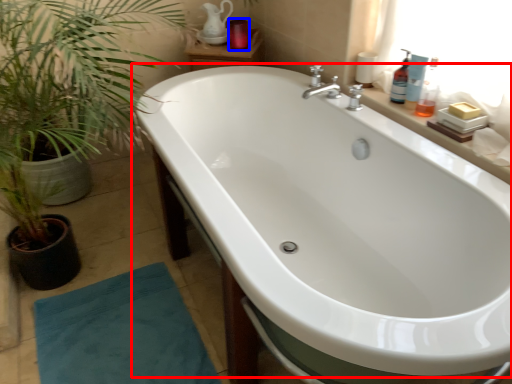
Question: Which object appears farthest to the camera in this image, bathtub (highlighted by a red box) or toiletry (highlighted by a blue box)?

Choices:
 (A) bathtub
 (B) toiletry

Answer: (B)